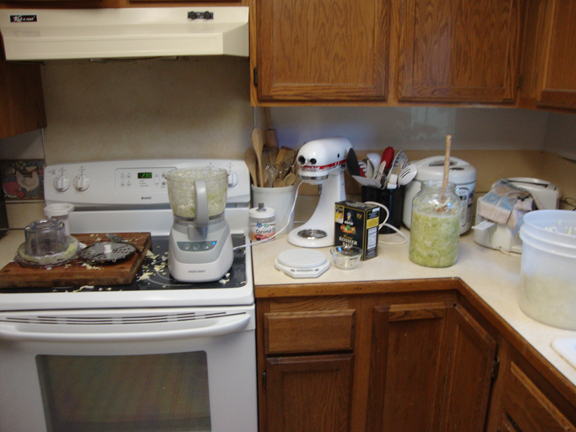
Identify the location of mixer. (325, 155).